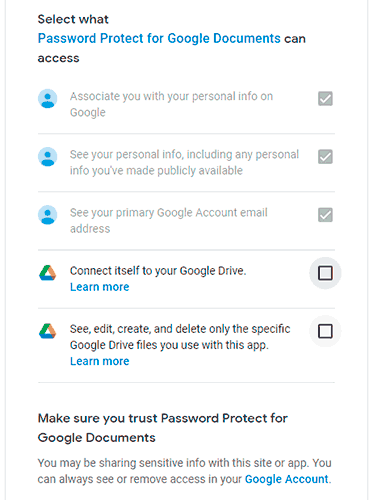
At what (x,y) coordinates should I click in order to perform the action: click on empty boxes. Please return your answer as a coordinate pair (x, y). Looking at the image, I should click on (324, 270), (324, 328).